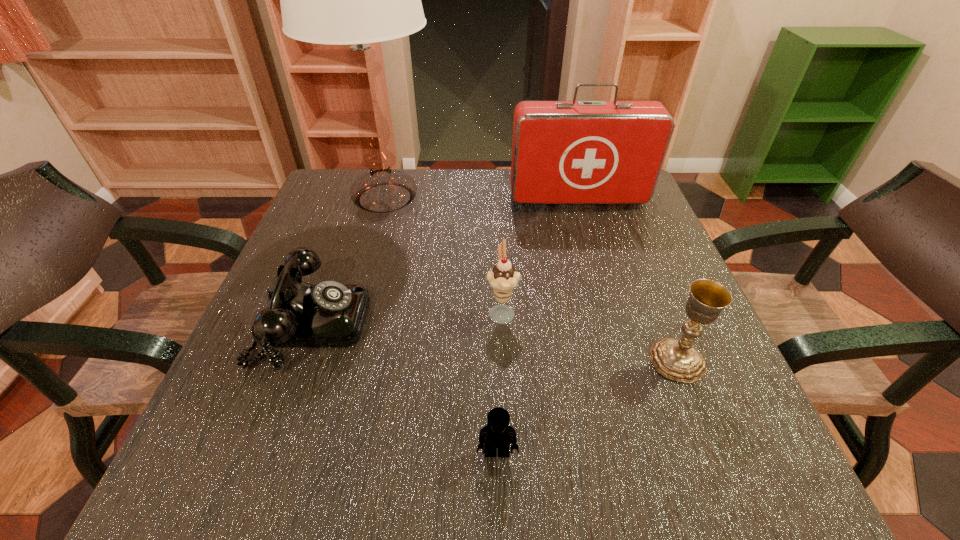
Find the location of `vacant region between the icecream and the telephone`. vacant region between the icecream and the telephone is located at coordinates (407, 317).

In order to click on vacant area between the chalice and the table lamp in this screenshot , I will do `click(531, 279)`.

What are the coordinates of `blank region between the icecream and the chalice` in the screenshot? It's located at (589, 336).

Where is `vacant space that's between the nearest object and the telephone`? This screenshot has width=960, height=540. vacant space that's between the nearest object and the telephone is located at coordinates (404, 387).

The width and height of the screenshot is (960, 540). Find the location of `vacant region between the first-aid kit and the icecream`. vacant region between the first-aid kit and the icecream is located at coordinates (540, 255).

Where is `free space between the icecream and the chalice`? free space between the icecream and the chalice is located at coordinates (589, 336).

Where is `blank region between the table lamp and the nearest object`? The height and width of the screenshot is (540, 960). blank region between the table lamp and the nearest object is located at coordinates (441, 325).

Select which object appears as the fourth closest to the table lamp. Please provide its 2D coordinates. Your answer should be formatted as a tuple, i.e. [(x, y)], where the tuple contains the x and y coordinates of a point satisfying the conditions above.

[(677, 359)]

Point out which object is positioned as the nearest to the tallest object. Please provide its 2D coordinates. Your answer should be formatted as a tuple, i.e. [(x, y)], where the tuple contains the x and y coordinates of a point satisfying the conditions above.

[(328, 314)]

You are a GUI agent. You are given a task and a screenshot of the screen. Output one action in this format:
    pyautogui.click(x=<x>, y=<y>)
    Task: Click on the vacant region that satisfies the following two spatial constraints: 1. on the side of the first-aid kit with the first aid cross symbol; 2. on the dial of the telephone
    
    Given the screenshot: What is the action you would take?
    pyautogui.click(x=613, y=322)